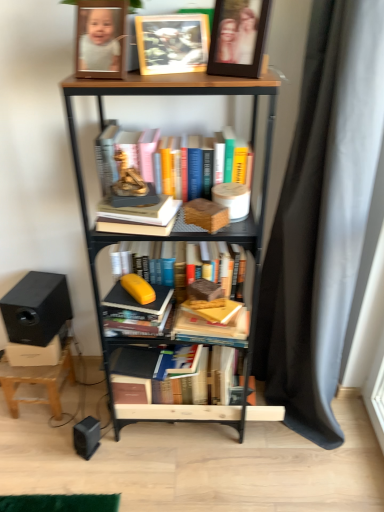
Identify the location of vacant space that is in between wooden stool at lower left and black plastic speaker at lower left, which appears as the 2th speaker when viewed from the left. (77, 419).